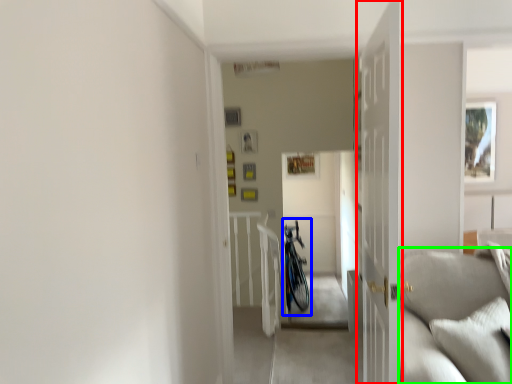
Question: Which is nearer to the door (highlighted by a red box)? bicycle (highlighted by a blue box) or couch (highlighted by a green box).

Choices:
 (A) bicycle
 (B) couch

Answer: (B)